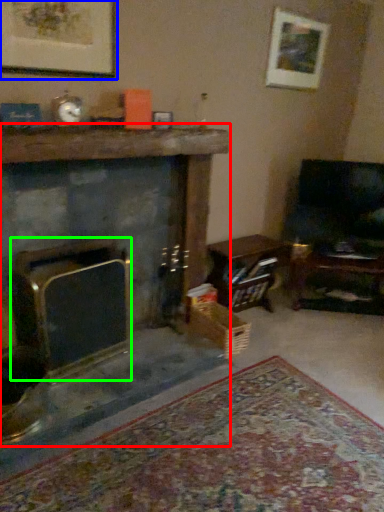
Question: Which object is the farthest from fireplace (highlighted by a red box)? Choose among these: picture frame (highlighted by a blue box) or fireplace (highlighted by a green box).

Choices:
 (A) picture frame
 (B) fireplace

Answer: (B)